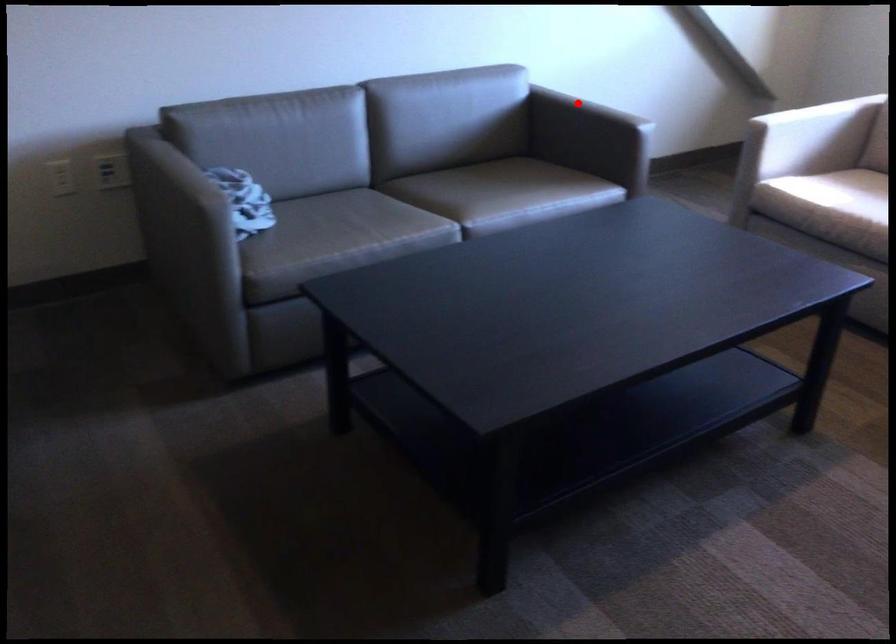
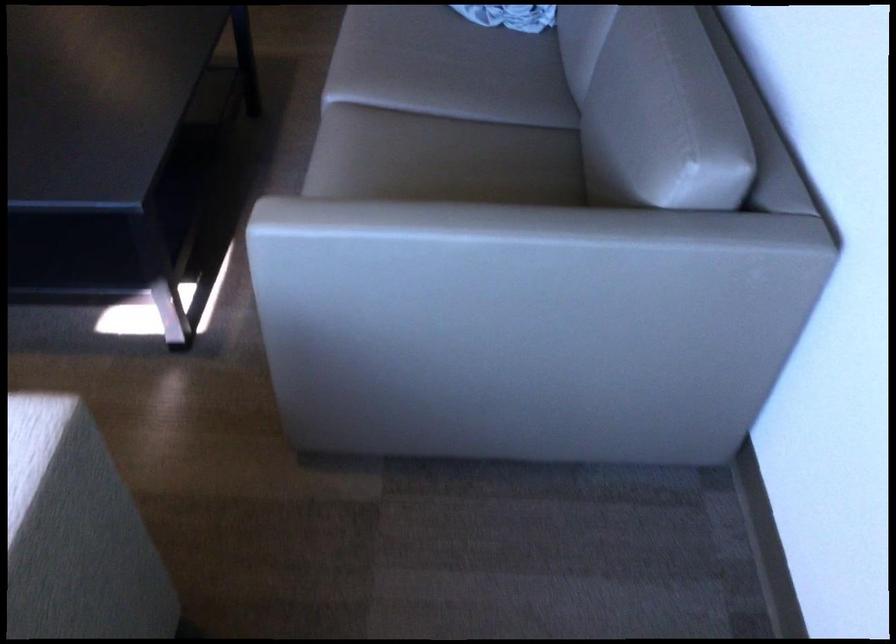
Question: I am providing you with two images of the same scene from different viewpoints. A red point is shown in image1. For the corresponding object point in image2, is it positioned nearer or farther from the camera?

Choices:
 (A) Nearer
 (B) Farther

Answer: (A)